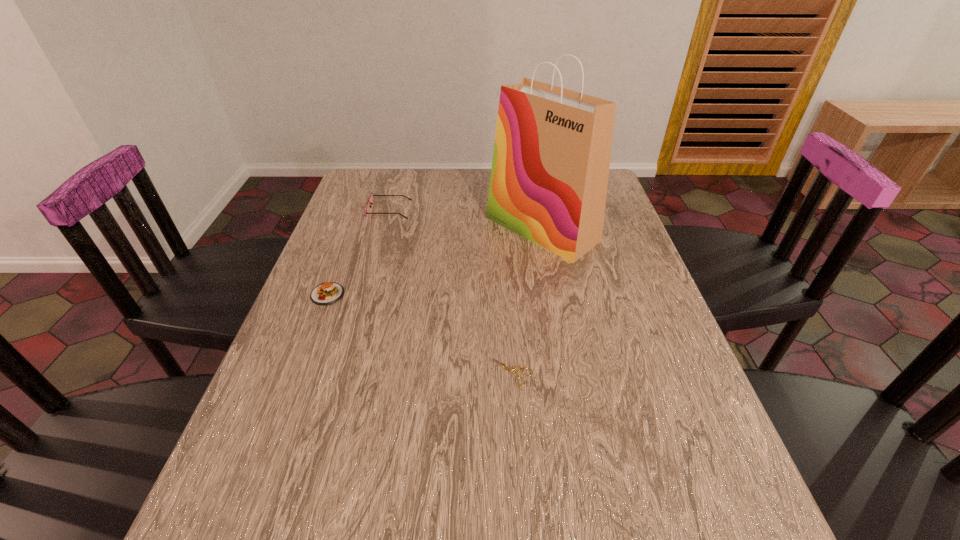
This screenshot has height=540, width=960. What are the coordinates of `shopping bag at the far edge` in the screenshot? It's located at (550, 167).

Where is `sunglasses located at the far edge`? This screenshot has width=960, height=540. sunglasses located at the far edge is located at coordinates (370, 200).

At what (x,y) coordinates should I click in order to perform the action: click on sunglasses that is at the left edge. Please return your answer as a coordinate pair (x, y). The width and height of the screenshot is (960, 540). Looking at the image, I should click on (370, 200).

Identify the location of patty (food) that is at the left edge. The image size is (960, 540). [327, 293].

Identify the location of object that is at the right edge. (550, 167).

The image size is (960, 540). I want to click on object that is at the far left corner, so click(x=370, y=200).

Locate an element on the screen. The height and width of the screenshot is (540, 960). object that is at the far right corner is located at coordinates (550, 167).

In the image, there is a desktop. What are the coordinates of `vacant space at the far edge` in the screenshot? It's located at (445, 174).

Where is `vacant space at the left edge`? vacant space at the left edge is located at coordinates (309, 457).

Identify the location of free space at the right edge of the desktop. 637,314.